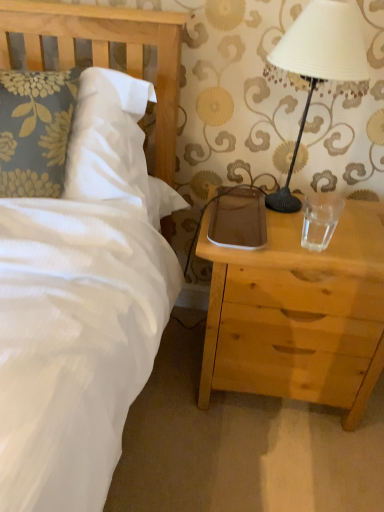
Question: Is wooden headboard at upper left positioned in front of brown leather pad at right?

Choices:
 (A) yes
 (B) no

Answer: (A)

Question: Is wooden headboard at upper left turned away from brown leather pad at right?

Choices:
 (A) yes
 (B) no

Answer: (B)

Question: From a real-world perspective, is wooden headboard at upper left on brown leather pad at right?

Choices:
 (A) no
 (B) yes

Answer: (B)

Question: Is wooden headboard at upper left bigger than brown leather pad at right?

Choices:
 (A) no
 (B) yes

Answer: (B)

Question: From a real-world perspective, does wooden headboard at upper left sit lower than brown leather pad at right?

Choices:
 (A) yes
 (B) no

Answer: (B)

Question: Is wooden headboard at upper left shorter than brown leather pad at right?

Choices:
 (A) yes
 (B) no

Answer: (B)

Question: Is white matte lampshade at upper right in front of transparent glass at right?

Choices:
 (A) no
 (B) yes

Answer: (B)

Question: Is white matte lampshade at upper right aimed at transparent glass at right?

Choices:
 (A) yes
 (B) no

Answer: (A)

Question: Can you confirm if white matte lampshade at upper right is thinner than transparent glass at right?

Choices:
 (A) no
 (B) yes

Answer: (A)

Question: Is the depth of white matte lampshade at upper right greater than that of transparent glass at right?

Choices:
 (A) yes
 (B) no

Answer: (B)

Question: Considering the relative sizes of white matte lampshade at upper right and transparent glass at right in the image provided, is white matte lampshade at upper right bigger than transparent glass at right?

Choices:
 (A) yes
 (B) no

Answer: (A)

Question: Is white matte lampshade at upper right in contact with transparent glass at right?

Choices:
 (A) no
 (B) yes

Answer: (A)

Question: From a real-world perspective, is brown leather pad at right beneath transparent glass at right?

Choices:
 (A) no
 (B) yes

Answer: (B)